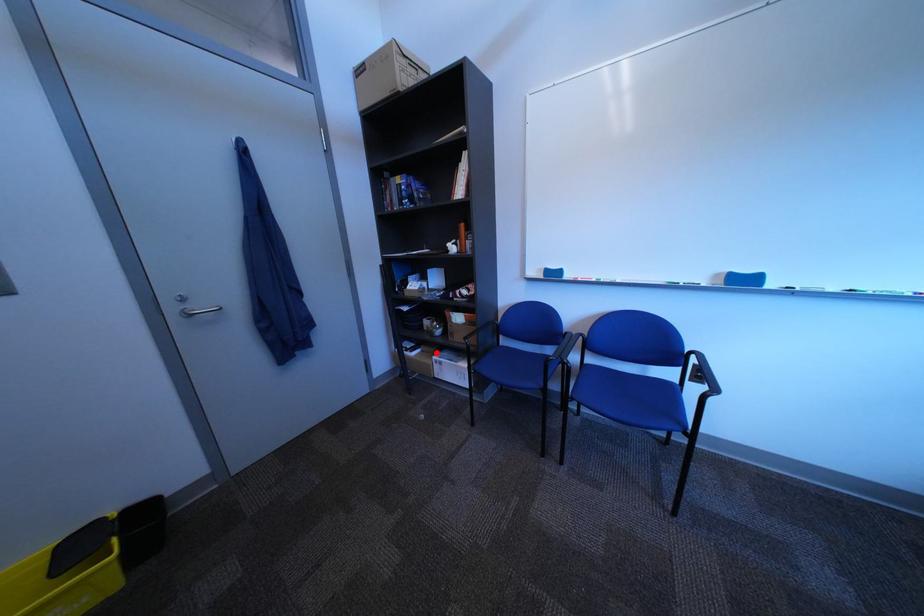
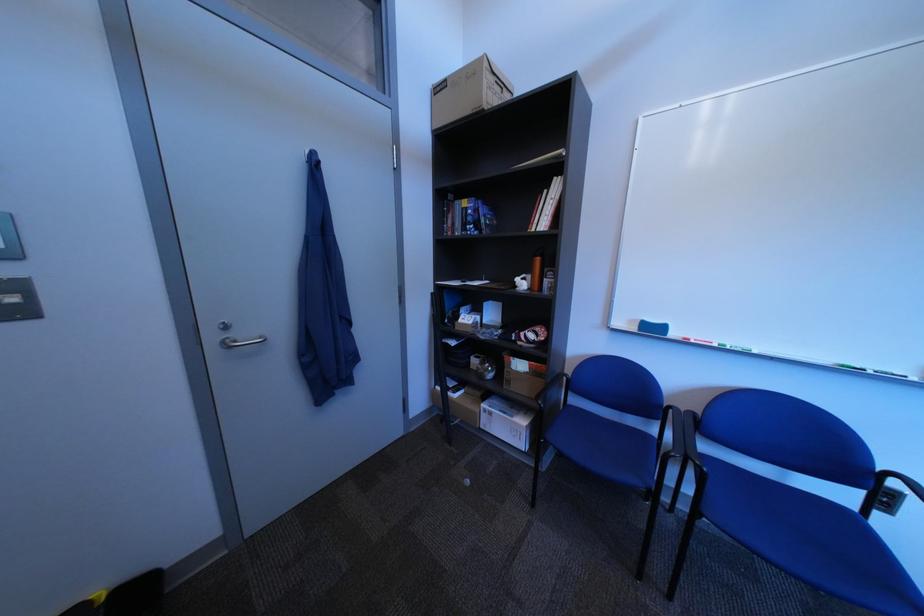
The point at the highlighted location is marked in the first image. Where is the corresponding point in the second image?

(480, 394)